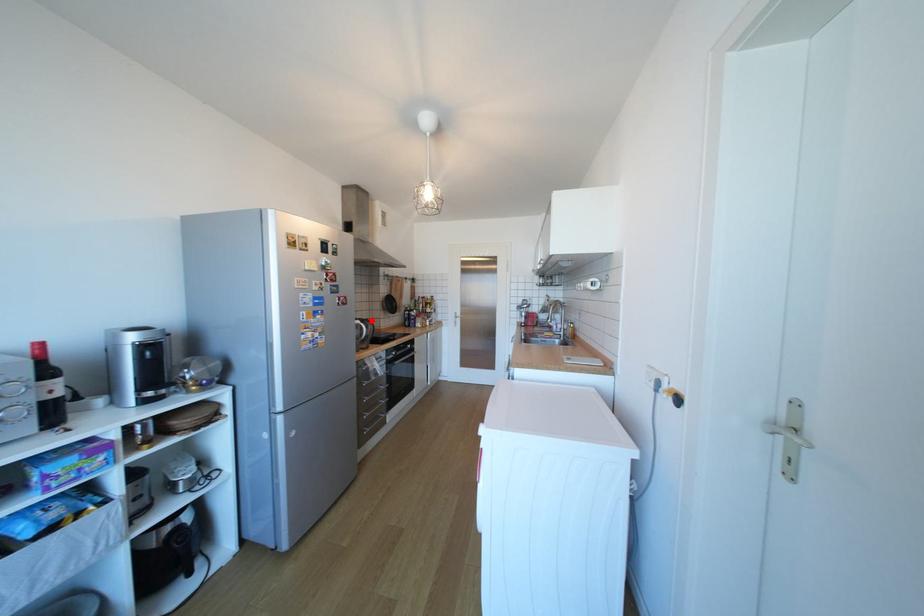
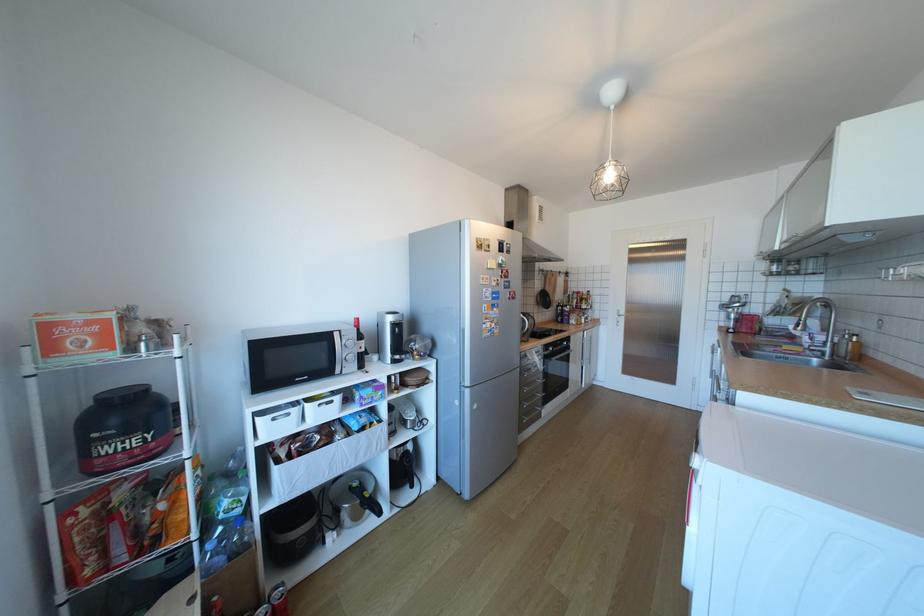
The point at the highlighted location is marked in the first image. Where is the corresponding point in the second image?

(532, 314)